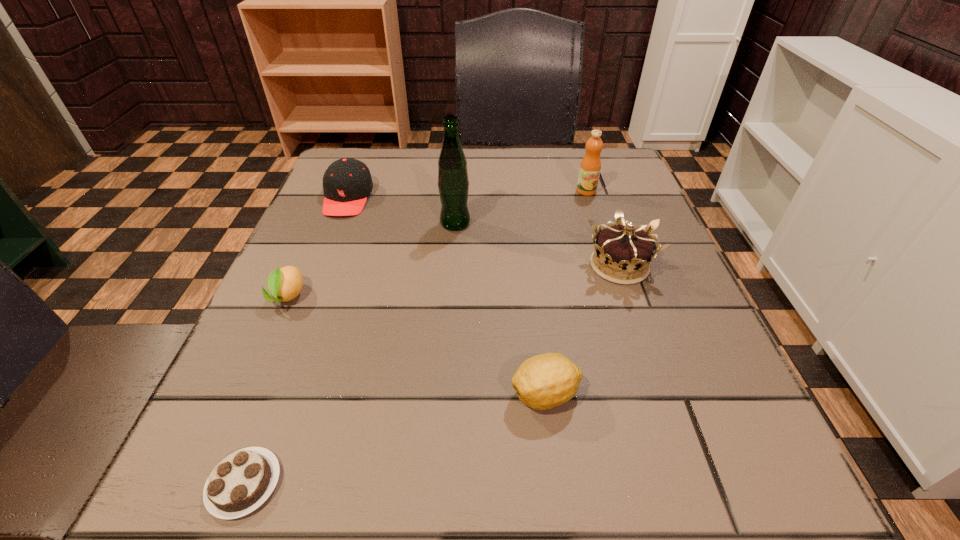
Find the location of a particular element. object that is at the far right corner is located at coordinates (590, 167).

This screenshot has height=540, width=960. I want to click on free space at the far edge, so point(560,152).

Where is `free region at the near edge of the desktop`? free region at the near edge of the desktop is located at coordinates tap(587, 507).

The image size is (960, 540). In order to click on vacant region at the left edge of the desktop in this screenshot , I will do `click(354, 234)`.

Identify the location of vacant space at the near left corner of the desktop. [286, 449].

Locate an element on the screen. vacant space at the far right corner is located at coordinates (598, 195).

The width and height of the screenshot is (960, 540). I want to click on free spot between the orange juice and the left lemon, so click(437, 244).

Where is `empty space that is in between the cap and the chocolate cake`? The height and width of the screenshot is (540, 960). empty space that is in between the cap and the chocolate cake is located at coordinates (296, 341).

Identify the location of free space that is in between the second shortest object and the orange juice. (437, 244).

The height and width of the screenshot is (540, 960). In order to click on free space between the beer bottle and the nearest object in this screenshot , I will do `click(349, 354)`.